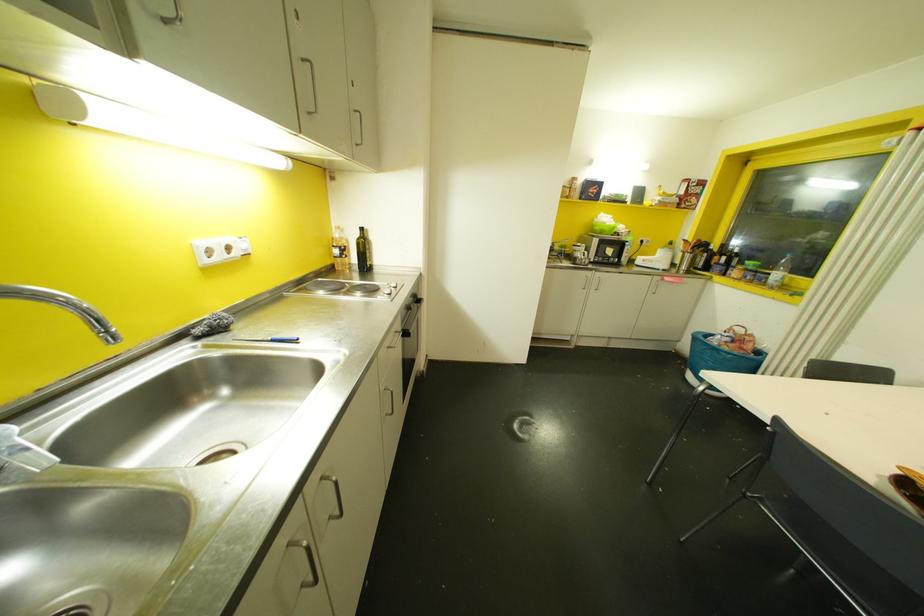
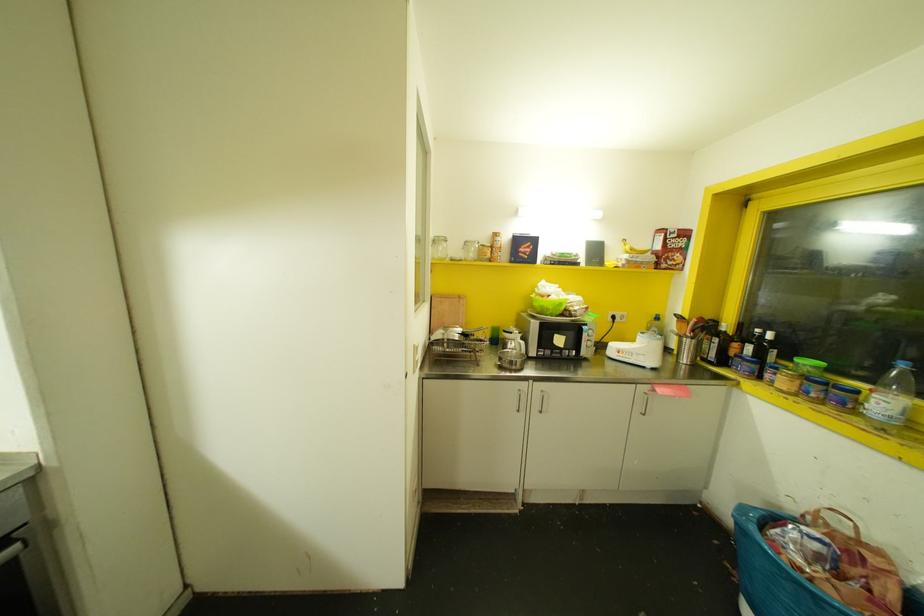
In the second image, find the point that corresponds to [711,334] in the first image.

(773, 517)